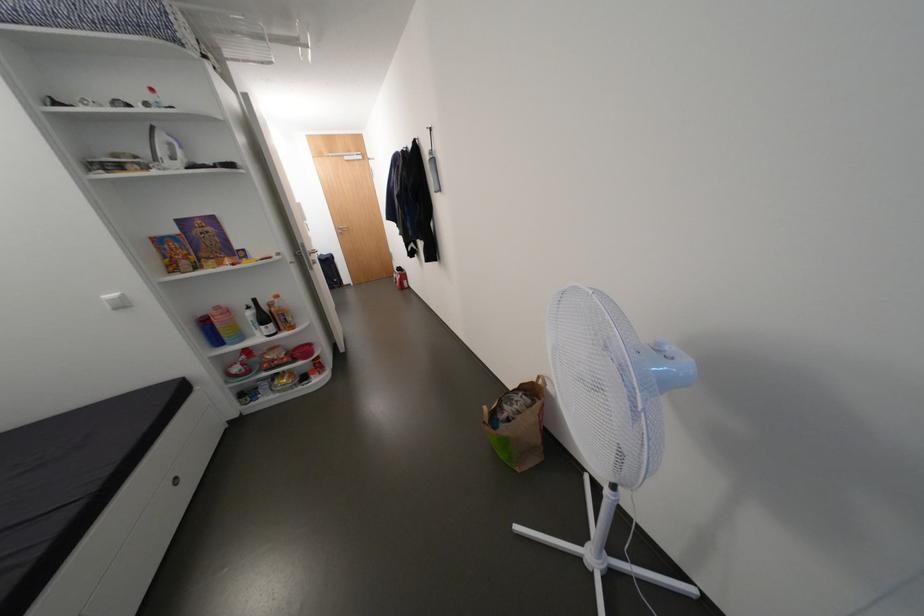
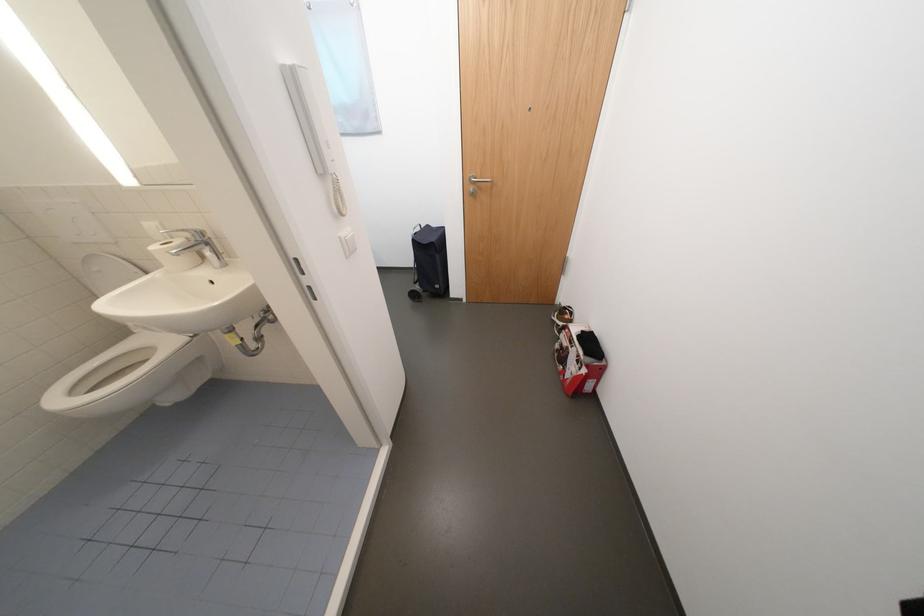
Find the pixel in the second image that matches point 346,229 in the first image.

(478, 180)